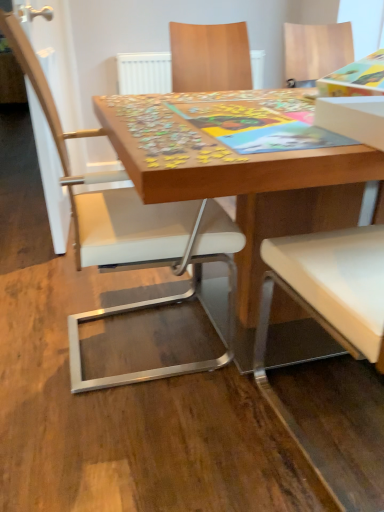
Question: Considering the relative sizes of wooden puzzle board at center and white leather chair at center in the image provided, is wooden puzzle board at center wider than white leather chair at center?

Choices:
 (A) no
 (B) yes

Answer: (B)

Question: Is wooden puzzle board at center to the left of white leather chair at center from the viewer's perspective?

Choices:
 (A) no
 (B) yes

Answer: (A)

Question: From a real-world perspective, is wooden puzzle board at center below white leather chair at center?

Choices:
 (A) yes
 (B) no

Answer: (A)

Question: Is wooden puzzle board at center not near white leather chair at center?

Choices:
 (A) yes
 (B) no

Answer: (B)

Question: Is wooden puzzle board at center to the right of white leather chair at center from the viewer's perspective?

Choices:
 (A) no
 (B) yes

Answer: (B)

Question: From the image's perspective, is wooden puzzle board at center on white leather chair at center?

Choices:
 (A) no
 (B) yes

Answer: (A)

Question: From a real-world perspective, is white leather chair at center on top of wooden puzzle pieces at center?

Choices:
 (A) yes
 (B) no

Answer: (A)

Question: Can you confirm if white leather chair at center is taller than wooden puzzle pieces at center?

Choices:
 (A) no
 (B) yes

Answer: (B)

Question: Can you confirm if white leather chair at center is thinner than wooden puzzle pieces at center?

Choices:
 (A) no
 (B) yes

Answer: (B)

Question: Is white leather chair at center shorter than wooden puzzle pieces at center?

Choices:
 (A) yes
 (B) no

Answer: (B)

Question: Does white leather chair at center touch wooden puzzle pieces at center?

Choices:
 (A) yes
 (B) no

Answer: (B)

Question: From a real-world perspective, is white leather chair at center under wooden puzzle pieces at center?

Choices:
 (A) no
 (B) yes

Answer: (A)

Question: From the image's perspective, is white leather chair at center below wooden puzzle board at center?

Choices:
 (A) no
 (B) yes

Answer: (A)